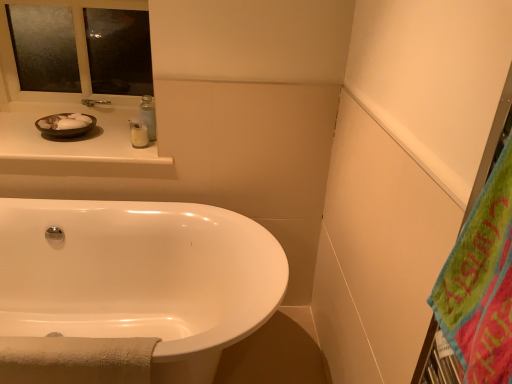
Question: Considering the positions of point (64, 94) and point (257, 327), is point (64, 94) closer or farther from the camera than point (257, 327)?

Choices:
 (A) closer
 (B) farther

Answer: (B)

Question: In terms of width, does frosted glass mirror at upper left look wider or thinner when compared to white glossy bathtub at lower left?

Choices:
 (A) thin
 (B) wide

Answer: (A)

Question: Estimate the real-world distances between objects in this image. Which object is farther from the green fuzzy beach towel at right?

Choices:
 (A) frosted glass mirror at upper left
 (B) matte black bowl at upper left
 (C) white glossy bathtub at lower left
 (D) white glossy lotion at upper center
 (E) matte white counter at upper left

Answer: (A)

Question: Estimate the real-world distances between objects in this image. Which object is farther from the white glossy bathtub at lower left?

Choices:
 (A) frosted glass mirror at upper left
 (B) white glossy lotion at upper center
 (C) matte black bowl at upper left
 (D) matte white counter at upper left
 (E) green fuzzy beach towel at right

Answer: (E)